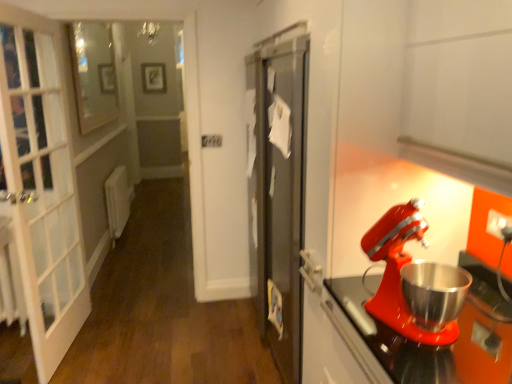
Question: Does matte black picture frame at upper center have a larger size compared to matte red mixer at right?

Choices:
 (A) no
 (B) yes

Answer: (A)

Question: Is matte black picture frame at upper center in contact with matte red mixer at right?

Choices:
 (A) yes
 (B) no

Answer: (B)

Question: Is matte black picture frame at upper center thinner than matte red mixer at right?

Choices:
 (A) yes
 (B) no

Answer: (A)

Question: Would you say matte black picture frame at upper center is outside matte red mixer at right?

Choices:
 (A) no
 (B) yes

Answer: (B)

Question: Does matte black picture frame at upper center have a greater height compared to matte red mixer at right?

Choices:
 (A) no
 (B) yes

Answer: (B)

Question: From the image's perspective, is matte black picture frame at upper center located above or below matte red mixer at right?

Choices:
 (A) above
 (B) below

Answer: (A)

Question: In the image, is matte black picture frame at upper center positioned in front of or behind matte red mixer at right?

Choices:
 (A) front
 (B) behind

Answer: (B)

Question: Does point [161, 77] appear closer or farther from the camera than point [404, 253]?

Choices:
 (A) closer
 (B) farther

Answer: (B)

Question: Considering the positions of matte black picture frame at upper center and matte red mixer at right in the image, is matte black picture frame at upper center wider or thinner than matte red mixer at right?

Choices:
 (A) thin
 (B) wide

Answer: (A)

Question: Choose the correct answer: Is clear glass window at upper left inside matte red mixer at right or outside it?

Choices:
 (A) outside
 (B) inside

Answer: (A)

Question: Is clear glass window at upper left bigger or smaller than matte red mixer at right?

Choices:
 (A) big
 (B) small

Answer: (A)

Question: Considering the positions of clear glass window at upper left and matte red mixer at right in the image, is clear glass window at upper left taller or shorter than matte red mixer at right?

Choices:
 (A) tall
 (B) short

Answer: (A)

Question: Is clear glass window at upper left in front of or behind matte red mixer at right in the image?

Choices:
 (A) behind
 (B) front

Answer: (A)

Question: Would you say clear glass window at upper left is inside or outside matte black picture frame at upper center?

Choices:
 (A) outside
 (B) inside

Answer: (A)

Question: Considering the positions of clear glass window at upper left and matte black picture frame at upper center in the image, is clear glass window at upper left wider or thinner than matte black picture frame at upper center?

Choices:
 (A) wide
 (B) thin

Answer: (B)